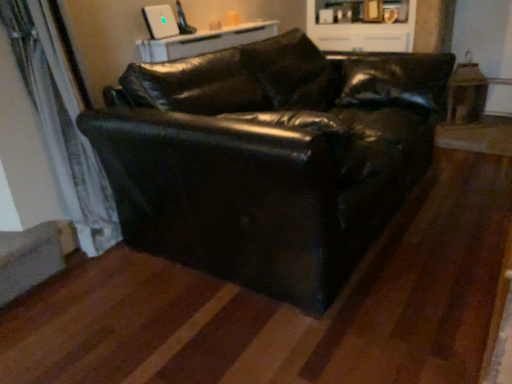
You are a GUI agent. You are given a task and a screenshot of the screen. Output one action in this format:
    pyautogui.click(x=<x>, y=<y>)
    Task: Click on the vacant area that is situated to the right of white sheer curtain at left
    The height and width of the screenshot is (384, 512).
    Given the screenshot: What is the action you would take?
    pyautogui.click(x=130, y=278)